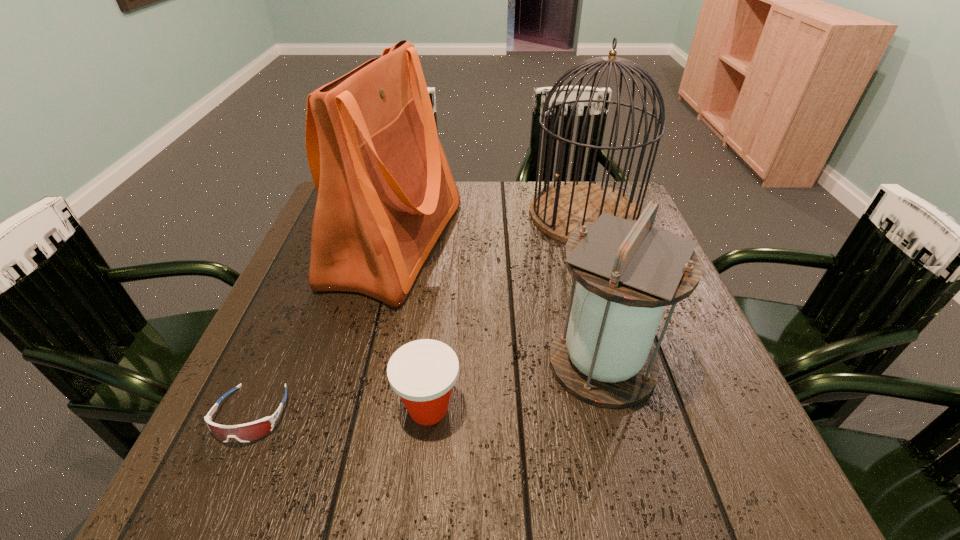
I want to click on the fourth closest object relative to the goggles, so click(x=559, y=210).

Identify which object is the closest to the shopping bag. Please provide its 2D coordinates. Your answer should be formatted as a tuple, i.e. [(x, y)], where the tuple contains the x and y coordinates of a point satisfying the conditions above.

[(423, 372)]